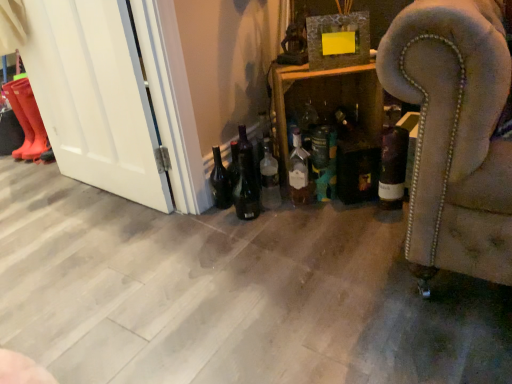
Find the location of a particular element. vacant area situated to the left side of dark glass bottle at center-right, the 1th bottle positioned from the right is located at coordinates (354, 214).